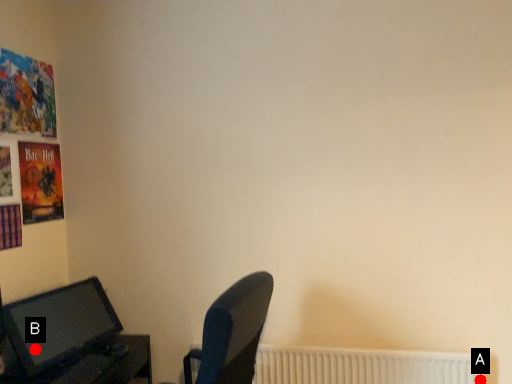
Question: Two points are circled on the image, labeled by A and B beside each circle. Among these points, which one is farthest from the camera?

Choices:
 (A) A is further
 (B) B is further

Answer: (A)